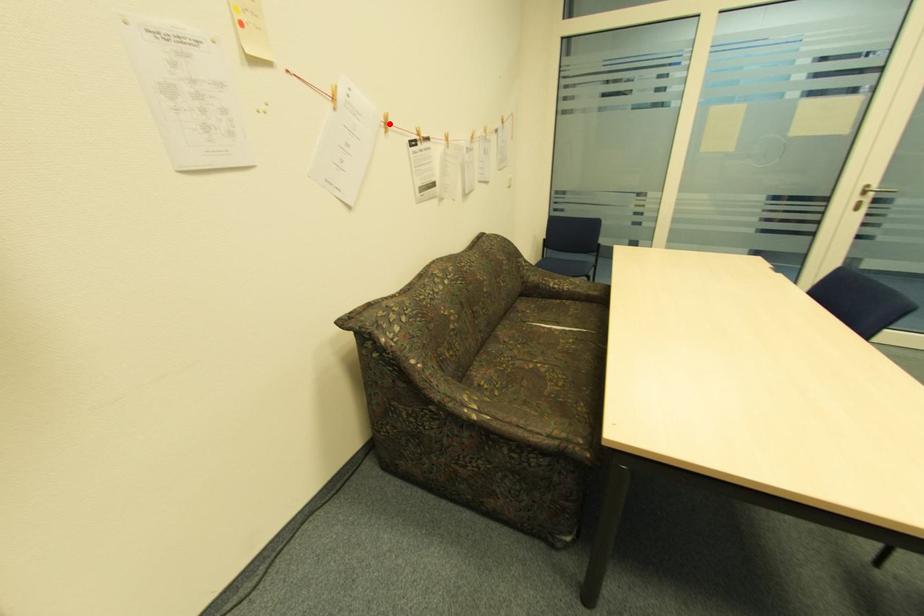
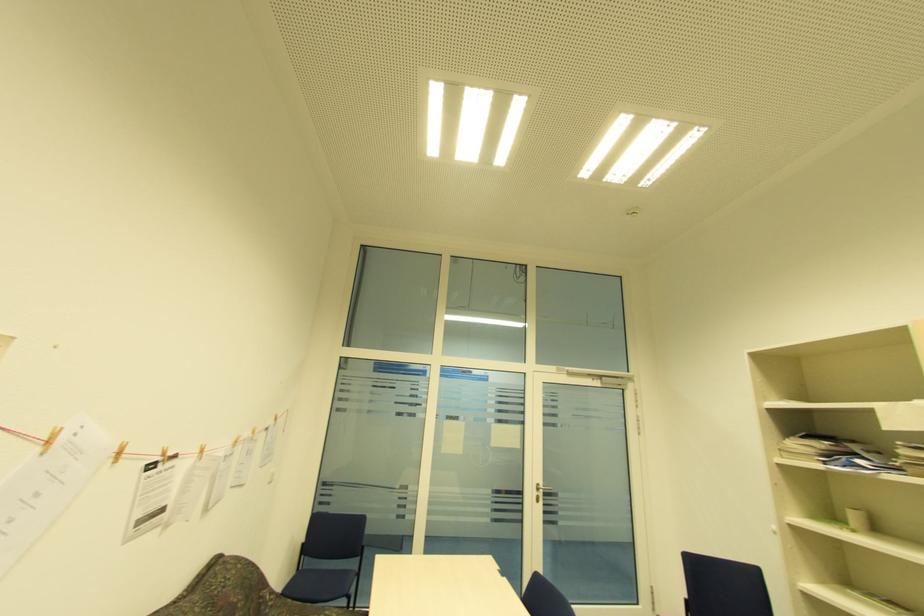
In the second image, find the point that corresponds to the highlighted location in the first image.

(120, 454)